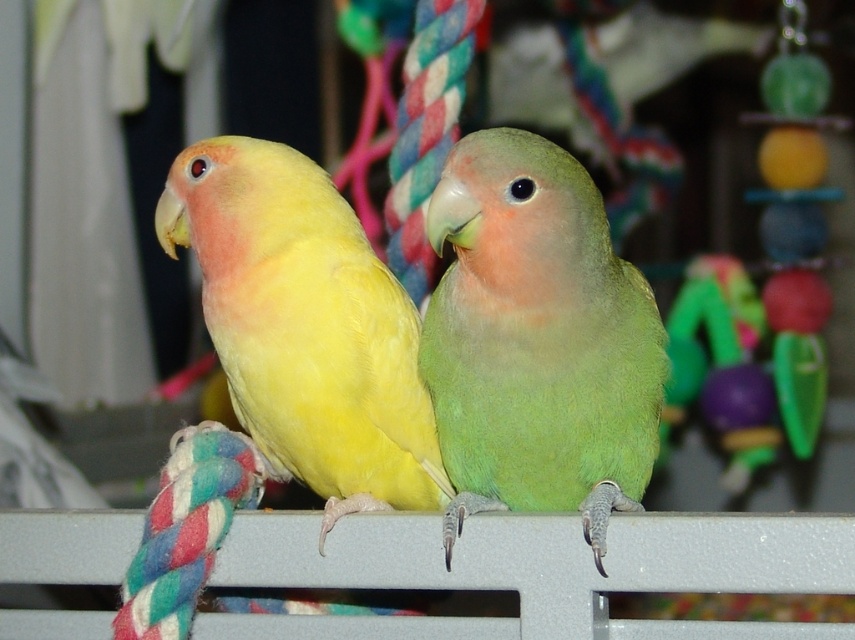
Which is behind, point (532, 435) or point (180, 173)?

Positioned behind is point (180, 173).

Which is above, green matte parrot at center or yellow matte parrot at left?

yellow matte parrot at left is higher up.

Between point (565, 292) and point (345, 428), which one is positioned in front?

Point (565, 292) is in front.

I want to click on green matte parrot at center, so click(537, 340).